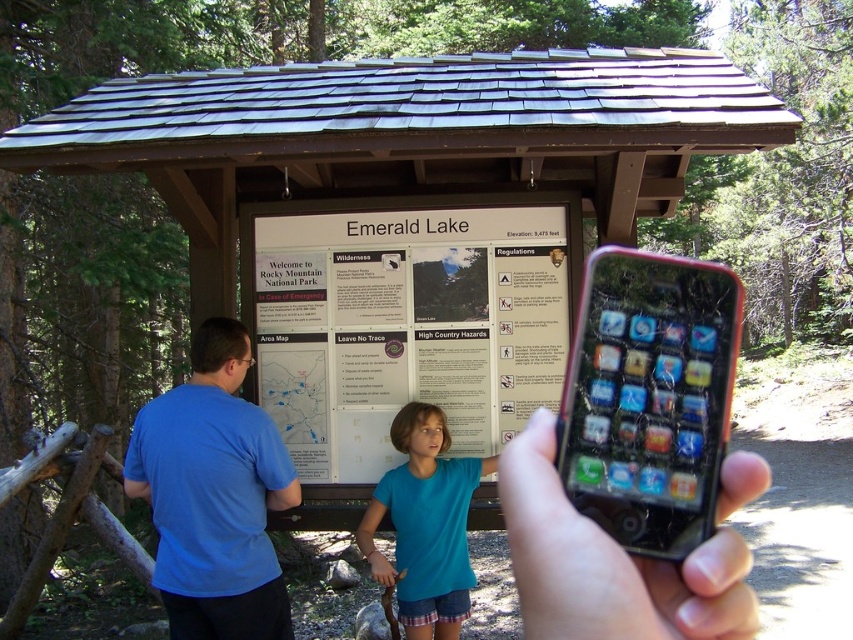
Does cracked glass smartphone at center have a greater height compared to blue cotton shirt at left?

Incorrect, cracked glass smartphone at center's height is not larger of blue cotton shirt at left's.

Between cracked glass smartphone at center and blue cotton shirt at left, which one has more height?

blue cotton shirt at left is taller.

Who is more distant from viewer, (701, 454) or (248, 451)?

The point (248, 451) is more distant.

The image size is (853, 640). What are the coordinates of `cracked glass smartphone at center` in the screenshot? It's located at point(648,397).

Who is positioned more to the right, white paper sign at center or blue cotton shirt at center?

blue cotton shirt at center

Is white paper sign at center to the left of blue cotton shirt at center from the viewer's perspective?

Indeed, white paper sign at center is positioned on the left side of blue cotton shirt at center.

What do you see at coordinates (405, 326) in the screenshot?
I see `white paper sign at center` at bounding box center [405, 326].

I want to click on white paper sign at center, so click(405, 326).

Is point (408, 232) behind point (583, 410)?

That is True.

This screenshot has width=853, height=640. Describe the element at coordinates (405, 326) in the screenshot. I see `white paper sign at center` at that location.

Locate an element on the screen. white paper sign at center is located at coordinates (405, 326).